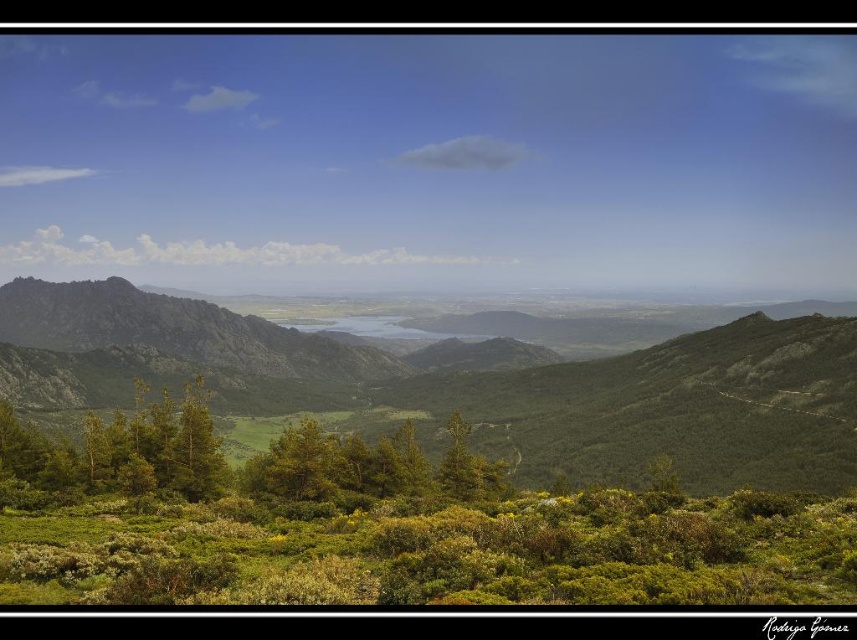
Question: Can you confirm if green textured mountain range at center is positioned to the left of green matte tree at center?

Choices:
 (A) yes
 (B) no

Answer: (A)

Question: Which of the following is the farthest from the observer?

Choices:
 (A) green leafy tree at center
 (B) green matte tree at center
 (C) green textured mountain range at center

Answer: (C)

Question: Which of the following is the closest to the observer?

Choices:
 (A) green leafy tree at center
 (B) green textured mountain range at center
 (C) green matte tree at center

Answer: (C)

Question: Which of the following is the closest to the observer?

Choices:
 (A) green matte tree at center
 (B) green textured mountain range at center

Answer: (A)

Question: Where is green leafy tree at center located in relation to green matte tree at center in the image?

Choices:
 (A) left
 (B) right

Answer: (A)

Question: Is green textured mountain range at center to the right of green leafy tree at center from the viewer's perspective?

Choices:
 (A) no
 (B) yes

Answer: (B)